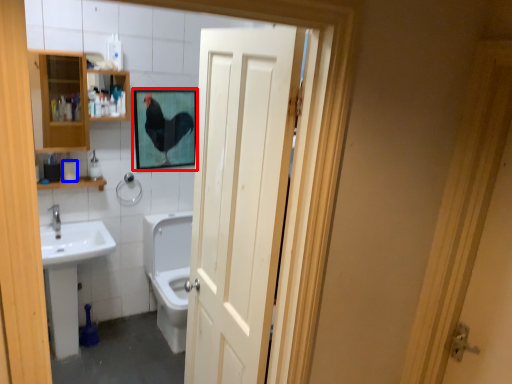
Question: Among these objects, which one is nearest to the camera, picture frame (highlighted by a red box) or toilet paper (highlighted by a blue box)?

Choices:
 (A) picture frame
 (B) toilet paper

Answer: (B)